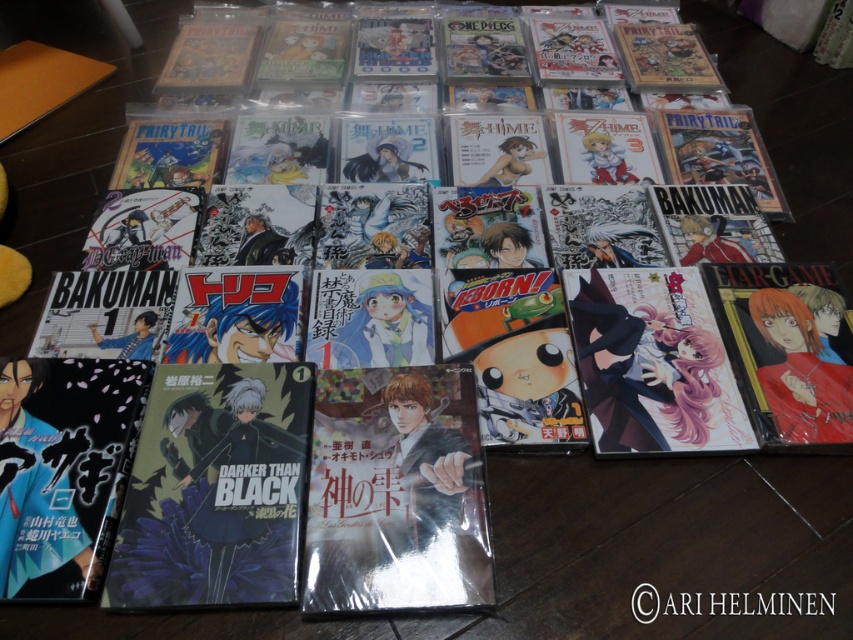
Question: Which object is the closest to the pink glossy manga at center-right?

Choices:
 (A) matte silver manga at center
 (B) matte black comic book at center

Answer: (A)

Question: Can you confirm if matte black comic book at center is bigger than pink glossy manga at center-right?

Choices:
 (A) yes
 (B) no

Answer: (A)

Question: Based on their relative distances, which object is nearer to the matte silver manga at center?

Choices:
 (A) matte black manga at bottom left
 (B) matte black comic book at center
 (C) pink glossy manga at center-right

Answer: (B)

Question: Can you confirm if matte black manga at bottom left is positioned below pink glossy manga at center-right?

Choices:
 (A) yes
 (B) no

Answer: (A)

Question: Which of the following is the closest to the observer?

Choices:
 (A) [x=4, y=566]
 (B) [x=292, y=444]
 (C) [x=645, y=342]

Answer: (A)

Question: Considering the relative positions of matte black comic book at center and pink glossy manga at center-right in the image provided, where is matte black comic book at center located with respect to pink glossy manga at center-right?

Choices:
 (A) below
 (B) above

Answer: (A)